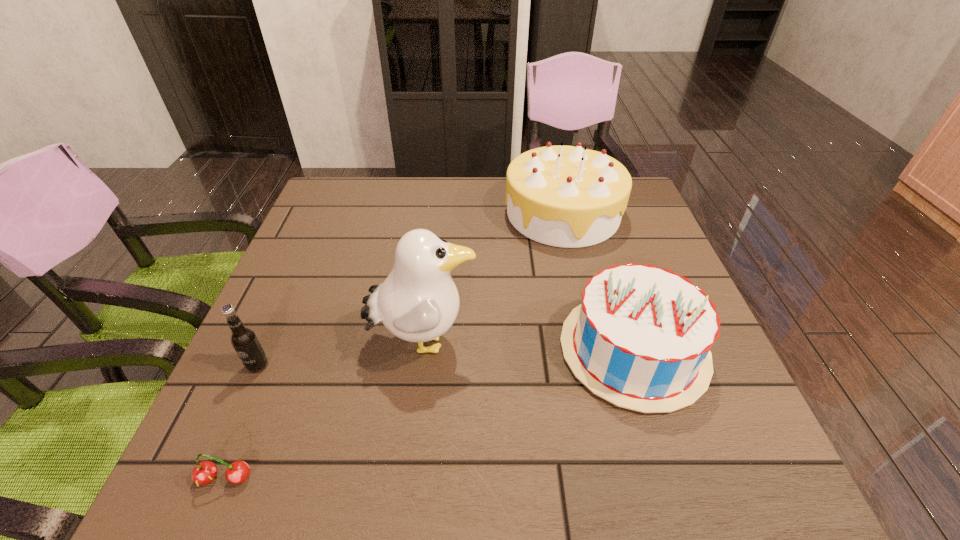
Select which object appears as the fourth closest to the farther birthday cake. Please provide its 2D coordinates. Your answer should be formatted as a tuple, i.e. [(x, y)], where the tuple contains the x and y coordinates of a point satisfying the conditions above.

[(204, 473)]

In order to click on object that stands as the third closest to the tallest object in this screenshot , I will do `click(204, 473)`.

Identify the location of free space that satisfies the following two spatial constraints: 1. on the beak of the gull; 2. on the right side of the shorter birthday cake. 422,350.

The height and width of the screenshot is (540, 960). Find the location of `vacant area that satisfies the following two spatial constraints: 1. on the front side of the farther birthday cake; 2. on the left side of the nearer birthday cake`. vacant area that satisfies the following two spatial constraints: 1. on the front side of the farther birthday cake; 2. on the left side of the nearer birthday cake is located at coordinates (595, 350).

Identify the location of free space in the image that satisfies the following two spatial constraints: 1. on the beak of the gull; 2. with stems pointing upwards on the shortest object. This screenshot has width=960, height=540. (407, 478).

The height and width of the screenshot is (540, 960). What are the coordinates of `vacant space that satisfies the following two spatial constraints: 1. on the beak of the nearer birthday cake; 2. on the left side of the gull` in the screenshot? It's located at (422, 350).

Locate an element on the screen. The image size is (960, 540). blank area in the image that satisfies the following two spatial constraints: 1. on the beak of the third object from left to right; 2. on the right side of the nearer birthday cake is located at coordinates (422, 350).

The image size is (960, 540). Identify the location of vacant space that satisfies the following two spatial constraints: 1. on the beak of the third object from left to right; 2. with stems pointing upwards on the cherry. (407, 478).